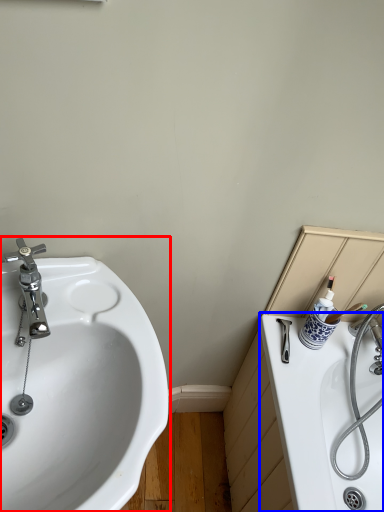
Question: Which object is closer to the camera taking this photo, sink (highlighted by a red box) or bath (highlighted by a blue box)?

Choices:
 (A) sink
 (B) bath

Answer: (A)